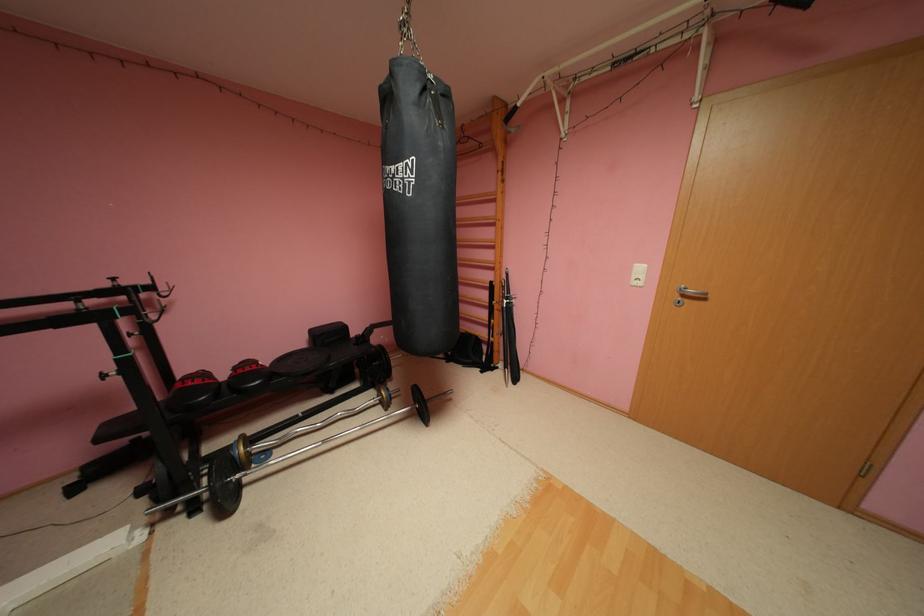
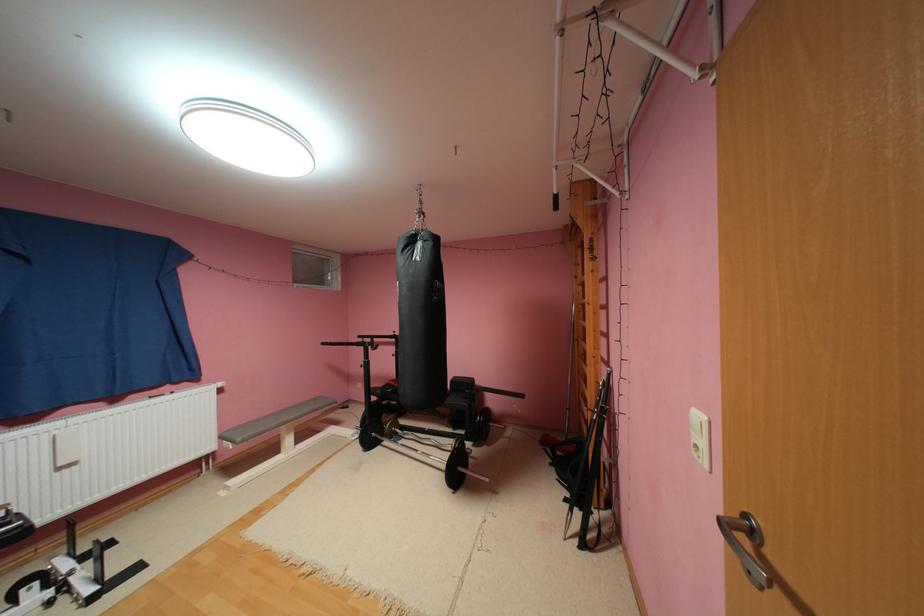
The point at (x=116, y=284) is marked in the first image. Where is the corresponding point in the second image?

(400, 334)